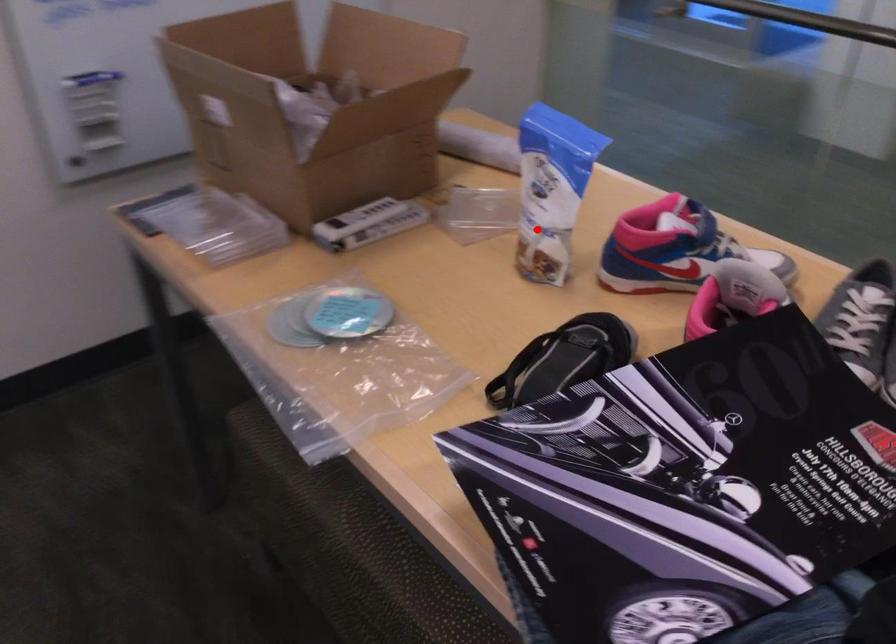
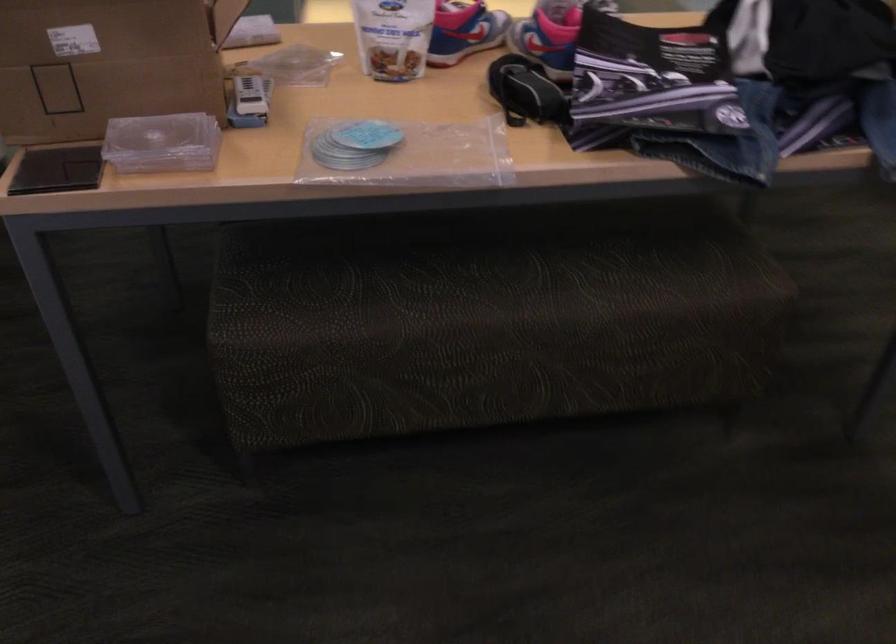
Question: I am providing you with two images of the same scene from different viewpoints. A red point is shown in image1. For the corresponding object point in image2, is it positioned nearer or farther from the camera?

Choices:
 (A) Nearer
 (B) Farther

Answer: (B)